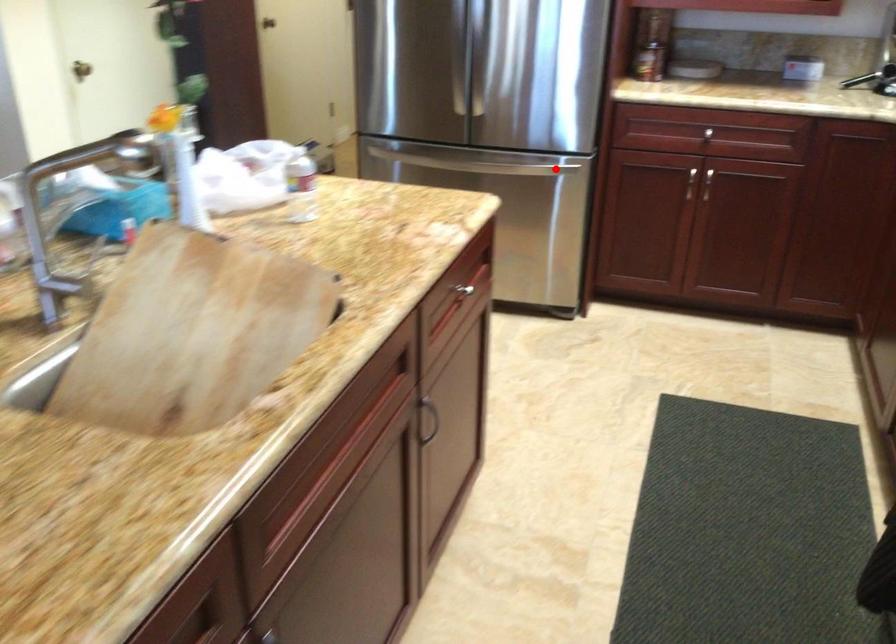
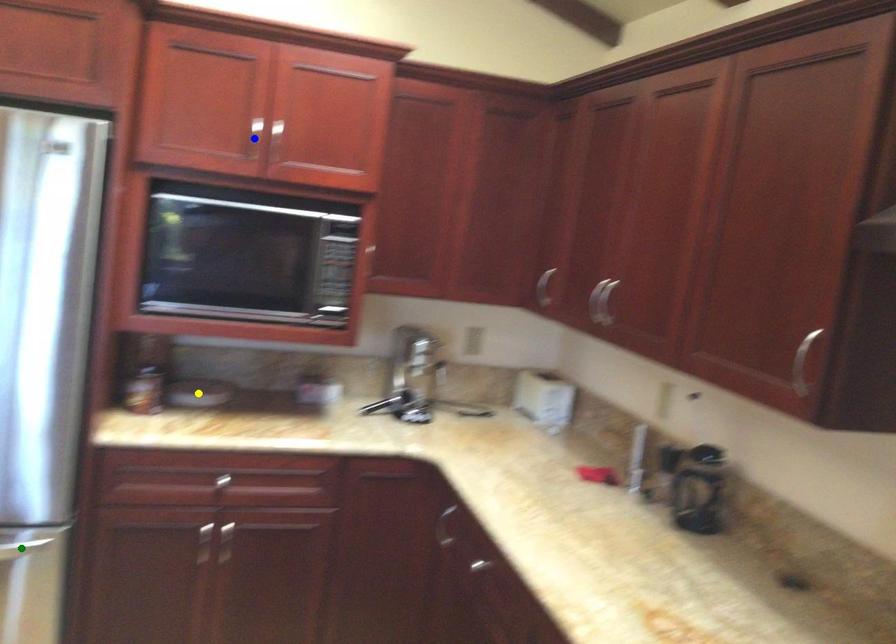
Question: I am providing you with two images of the same scene from different viewpoints. A red point is marked on the first image. You are given multiple points on the second image. Which spot in image 2 lines up with the point in image 1?

Choices:
 (A) yellow point
 (B) green point
 (C) blue point

Answer: (B)